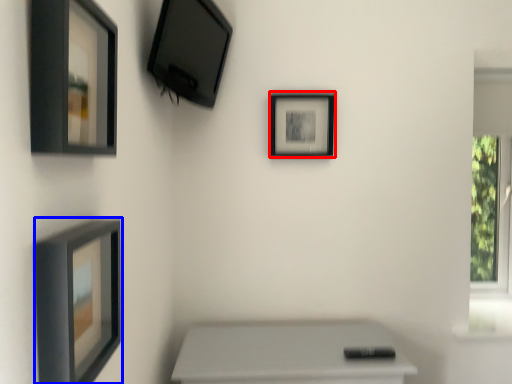
Question: Which point is closer to the camera, picture frame (highlighted by a red box) or picture frame (highlighted by a blue box)?

Choices:
 (A) picture frame
 (B) picture frame

Answer: (B)